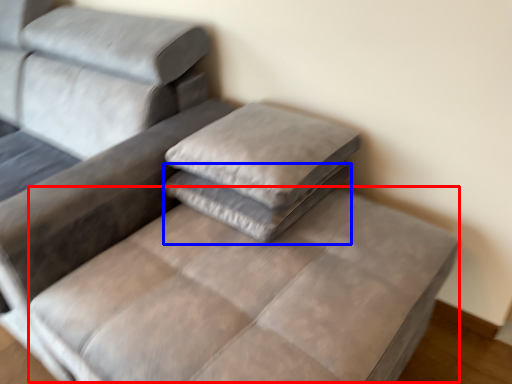
Question: Which object is closer to the camera taking this photo, mattress (highlighted by a red box) or pillow (highlighted by a blue box)?

Choices:
 (A) mattress
 (B) pillow

Answer: (A)